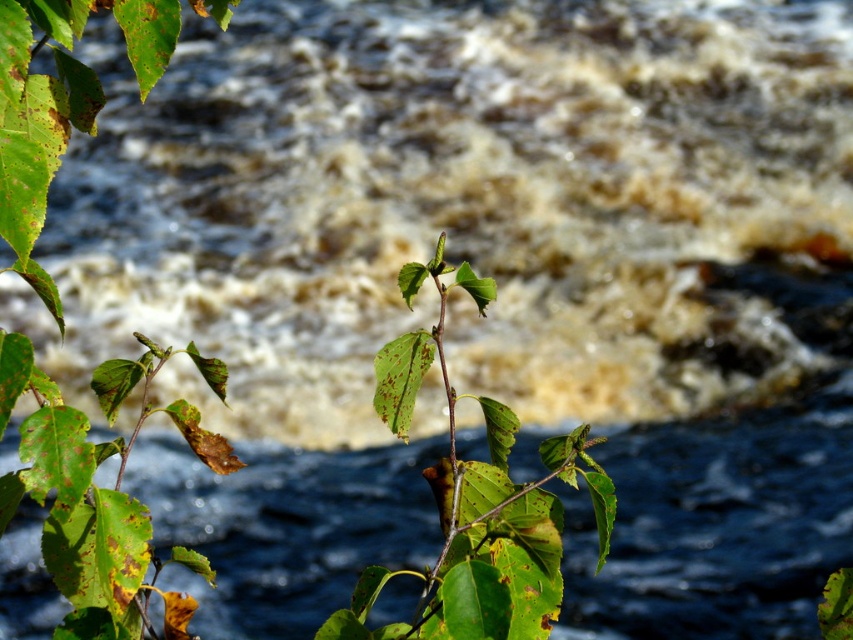
You are standing in front of the plant with green matte leaves at left and green matte leaf at center. Which leaf is nearer to you?

The green matte leaves at left is closer to the viewer than the green matte leaf at center.